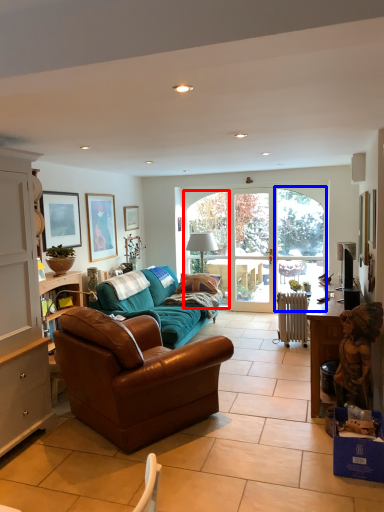
Question: Which object is further to the camera taking this photo, window (highlighted by a red box) or glass door (highlighted by a blue box)?

Choices:
 (A) window
 (B) glass door

Answer: (A)